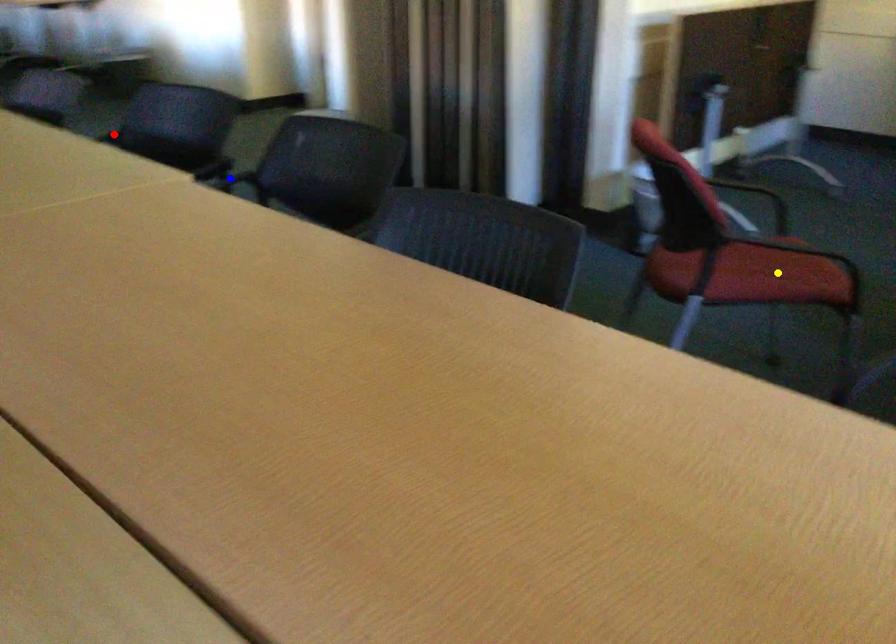
Order these from nearest to farthest:
A) yellow point
B) blue point
C) red point

blue point, yellow point, red point